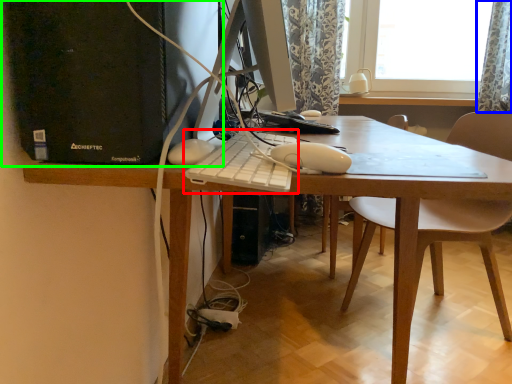
Question: Considering the real-world distances, which object is farthest from computer keyboard (highlighted by a red box)? curtain (highlighted by a blue box) or computer tower (highlighted by a green box)?

Choices:
 (A) curtain
 (B) computer tower

Answer: (A)